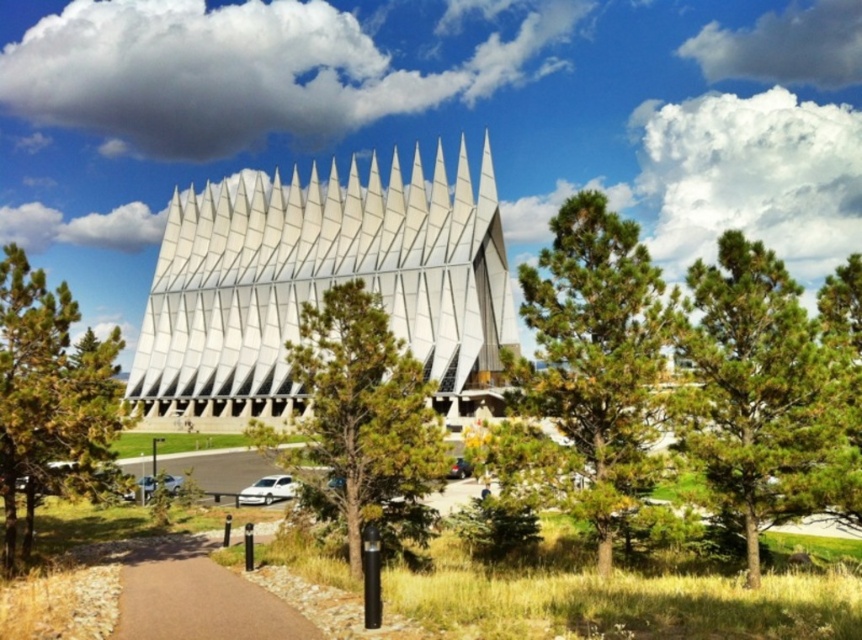
You are standing at the base of the green textured tree at center and want to walk to the brown asphalt path at lower left. Which direction should you face to head towards the path?

Since the green textured tree at center is above the brown asphalt path at lower left, you should face downward or towards the lower left direction to walk towards the path.

You are standing at the base of the triangular peaks of the building and looking towards the pathway. There is a point marked at coordinates point (759, 392). What is the nearest object to this point?

The nearest object to point (759, 392) is the green needle like leaves at center, as the point is located on them.